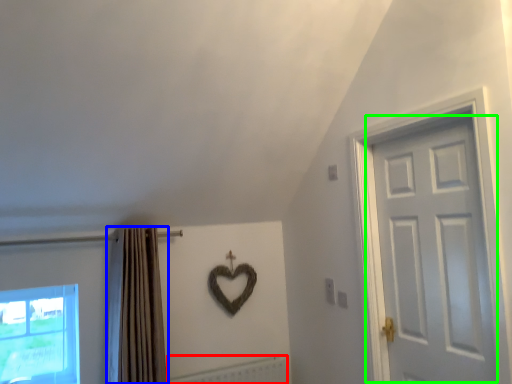
Question: Which is farther away from radiator (highlighted by a red box)? curtain (highlighted by a blue box) or door (highlighted by a green box)?

Choices:
 (A) curtain
 (B) door

Answer: (B)